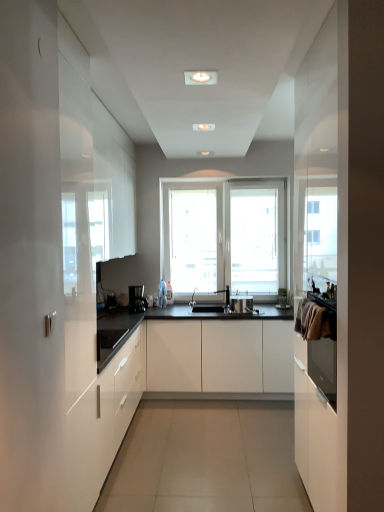
Question: Considering the relative positions of satin silver toaster at center and white glossy cabinet at left, the 1th cabinetry in the left-to-right sequence, in the image provided, is satin silver toaster at center to the left or to the right of white glossy cabinet at left, the 1th cabinetry in the left-to-right sequence,?

Choices:
 (A) right
 (B) left

Answer: (A)

Question: Is satin silver toaster at center wider or thinner than white glossy cabinet at left, marked as the second cabinetry in a right-to-left arrangement?

Choices:
 (A) thin
 (B) wide

Answer: (A)

Question: Considering the real-world distances, which object is farthest from the satin silver toaster at center?

Choices:
 (A) white glossy cabinet at left, marked as the second cabinetry in a right-to-left arrangement
 (B) black plastic coffee machine at center
 (C) white matte cabinet at center, which is the first cabinetry in right-to-left order

Answer: (A)

Question: Which object is the closest to the black plastic coffee machine at center?

Choices:
 (A) white glossy cabinet at left, the 1th cabinetry in the left-to-right sequence
 (B) satin silver toaster at center
 (C) white matte cabinet at center, which is the first cabinetry in right-to-left order

Answer: (C)